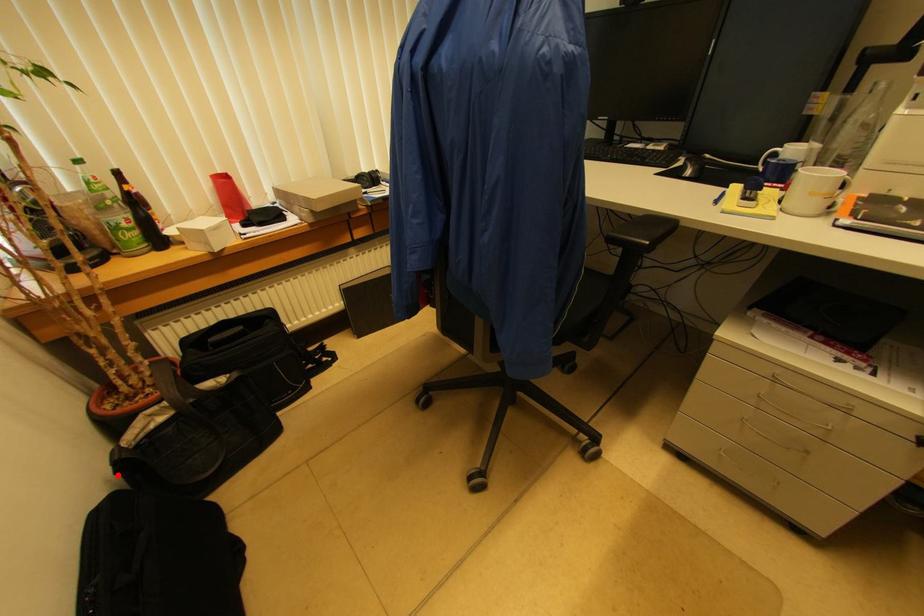
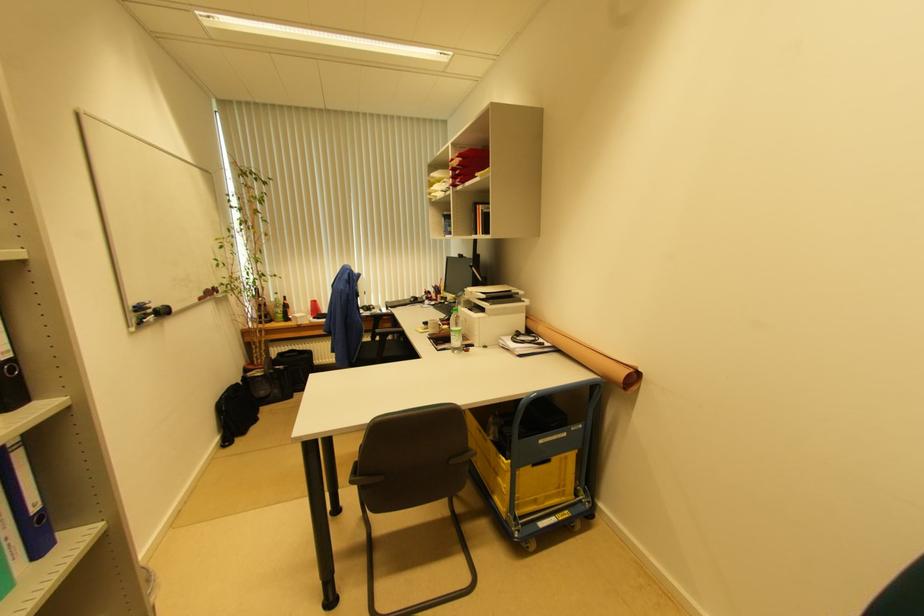
Where in the second image is the point corresponding to the highlighted location from the first image?

(242, 383)